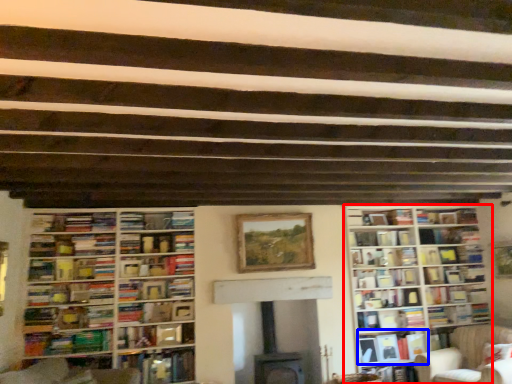
Question: Which object appears closest to the camera in this image, bookcase (highlighted by a red box) or book (highlighted by a blue box)?

Choices:
 (A) bookcase
 (B) book

Answer: (A)